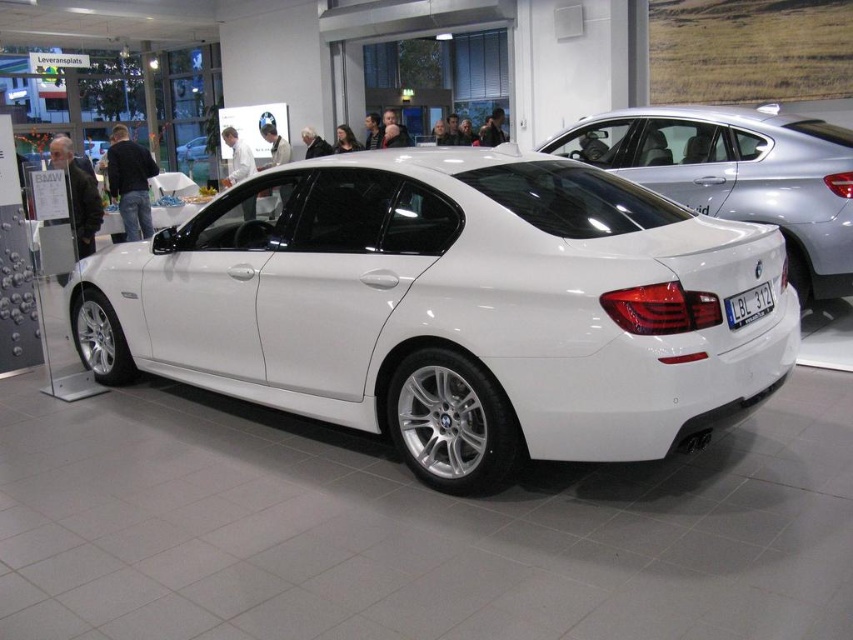
Question: Is white metallic car at center to the right of blue metallic license plate at rear from the viewer's perspective?

Choices:
 (A) no
 (B) yes

Answer: (A)

Question: Which point is closer to the camera?

Choices:
 (A) (729, 316)
 (B) (670, 264)
 (C) (808, 160)

Answer: (B)

Question: Which of the following is the farthest from the observer?

Choices:
 (A) (759, 289)
 (B) (791, 131)
 (C) (585, 326)

Answer: (B)

Question: Which object is the closest to the white glossy sedan at center?

Choices:
 (A) blue metallic license plate at rear
 (B) white metallic car at center

Answer: (A)

Question: Is white glossy sedan at center above blue metallic license plate at rear?

Choices:
 (A) no
 (B) yes

Answer: (B)

Question: Can you confirm if white glossy sedan at center is positioned to the left of blue metallic license plate at rear?

Choices:
 (A) no
 (B) yes

Answer: (A)